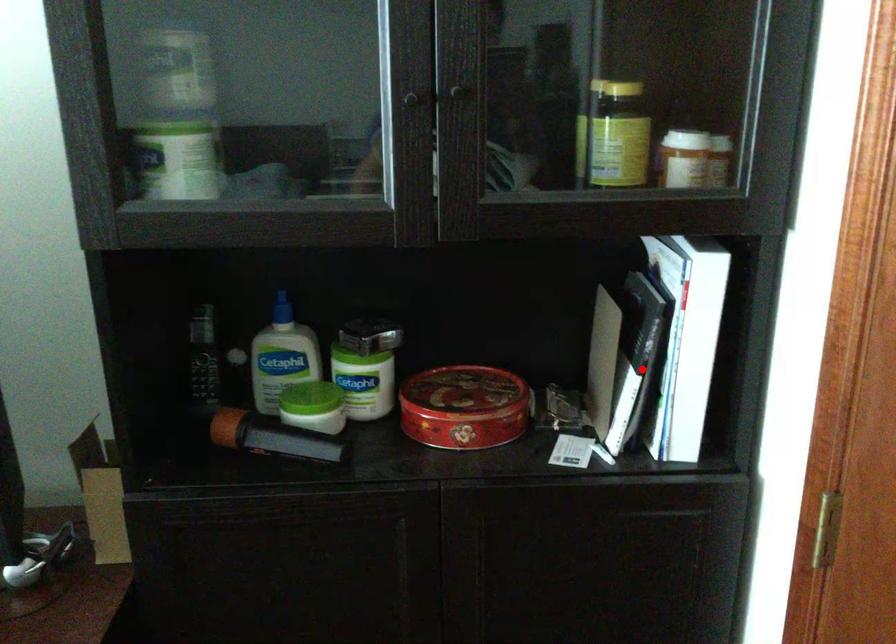
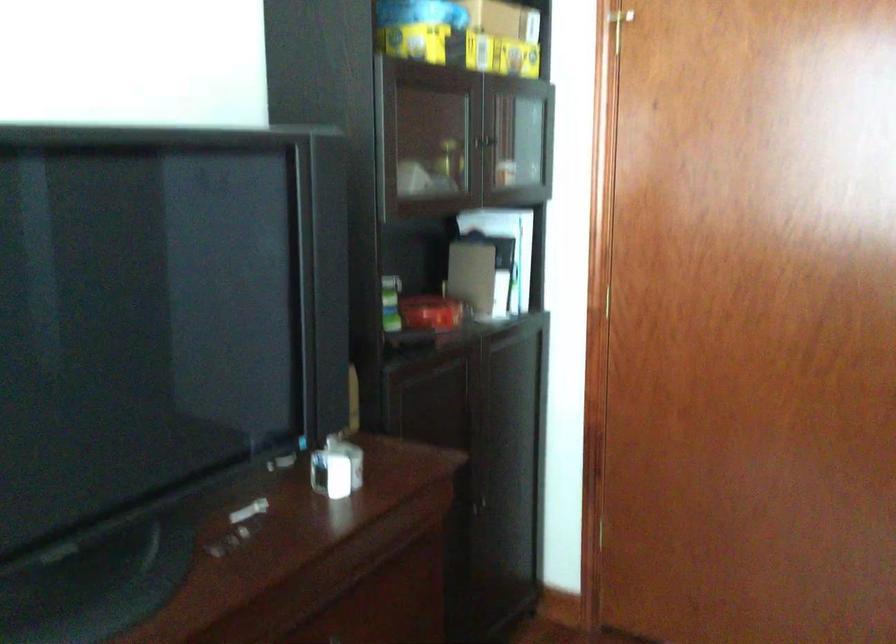
Find the pixel in the second image that matches the highlighted location in the first image.

(503, 272)